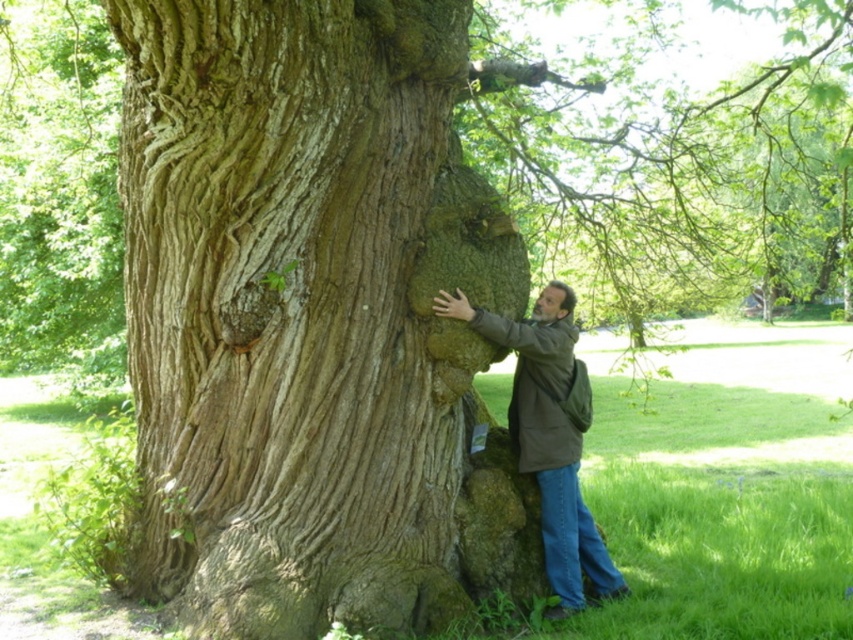
You are a photographer aiming to capture a portrait of the man in the brown leather jacket at center while ensuring the rough bark tree trunk at center is visible in the background. Based on their positions, can you position yourself so that the man is centered in the frame and the tree trunk remains fully visible behind him?

The rough bark tree trunk at center is positioned on the left side of brown leather jacket at center, so if you position yourself to center the man, the tree trunk will still be visible to his left in the background.

From the picture: You are a hiker who wants to take a photo of the rough bark tree trunk at center while keeping the brown leather jacket at center in the frame. Can you fit both in your camera viewfinder at the same time?

The rough bark tree trunk at center is located above the brown leather jacket at center, so yes, you can fit both in the camera viewfinder by adjusting the framing to include both the upper and lower parts of the scene.

From the picture: You are a painter standing in front of the rough bark tree trunk at center and the brown leather jacket at center. You want to paint the tree trunk first. Which object should you paint first according to their positions?

The rough bark tree trunk at center is in front of the brown leather jacket at center, so you should paint the rough bark tree trunk at center first.